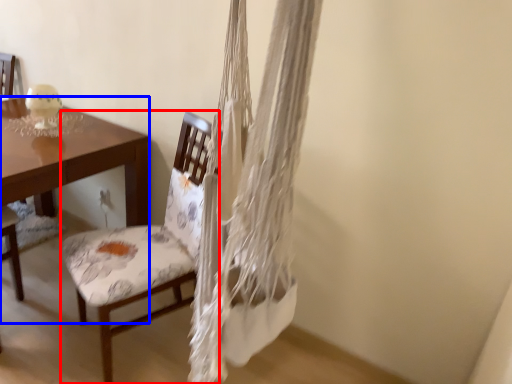
Question: Which object is closer to the camera taking this photo, chair (highlighted by a red box) or desk (highlighted by a blue box)?

Choices:
 (A) chair
 (B) desk

Answer: (A)